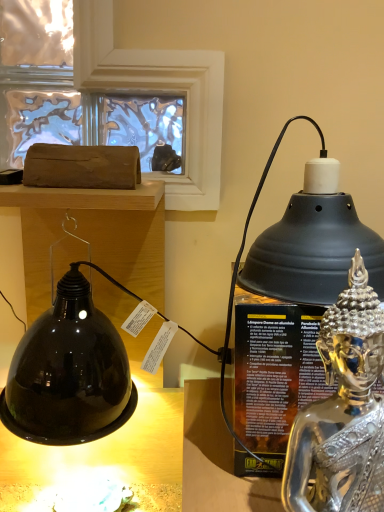
Question: Is silver metallic statue at right facing away from matte brown log at upper left?

Choices:
 (A) yes
 (B) no

Answer: (B)

Question: Does silver metallic statue at right have a larger size compared to matte brown log at upper left?

Choices:
 (A) no
 (B) yes

Answer: (A)

Question: From a real-world perspective, is silver metallic statue at right on top of matte brown log at upper left?

Choices:
 (A) yes
 (B) no

Answer: (B)

Question: Is silver metallic statue at right aimed at matte brown log at upper left?

Choices:
 (A) yes
 (B) no

Answer: (B)

Question: Would you say matte brown log at upper left is part of silver metallic statue at right's contents?

Choices:
 (A) yes
 (B) no

Answer: (B)

Question: Is matte brown log at upper left spatially inside silver metallic statue at right, or outside of it?

Choices:
 (A) outside
 (B) inside

Answer: (A)

Question: Does point (102, 249) appear closer or farther from the camera than point (380, 495)?

Choices:
 (A) closer
 (B) farther

Answer: (B)

Question: From the image's perspective, relative to silver metallic statue at right, is matte brown log at upper left above or below?

Choices:
 (A) below
 (B) above

Answer: (B)

Question: Considering their positions, is matte brown log at upper left located in front of or behind silver metallic statue at right?

Choices:
 (A) front
 (B) behind

Answer: (B)

Question: Is shiny metallic oil lamp at right in front of or behind matte brown log at upper left in the image?

Choices:
 (A) front
 (B) behind

Answer: (A)

Question: Considering the positions of point (329, 174) and point (23, 264), is point (329, 174) closer or farther from the camera than point (23, 264)?

Choices:
 (A) farther
 (B) closer

Answer: (B)

Question: Is shiny metallic oil lamp at right to the left or to the right of matte brown log at upper left in the image?

Choices:
 (A) right
 (B) left

Answer: (A)

Question: Is shiny metallic oil lamp at right wider or thinner than matte brown log at upper left?

Choices:
 (A) wide
 (B) thin

Answer: (B)

Question: In terms of width, does matte brown log at upper left look wider or thinner when compared to shiny metallic oil lamp at right?

Choices:
 (A) wide
 (B) thin

Answer: (A)

Question: Is matte brown log at upper left spatially inside shiny metallic oil lamp at right, or outside of it?

Choices:
 (A) outside
 (B) inside

Answer: (A)